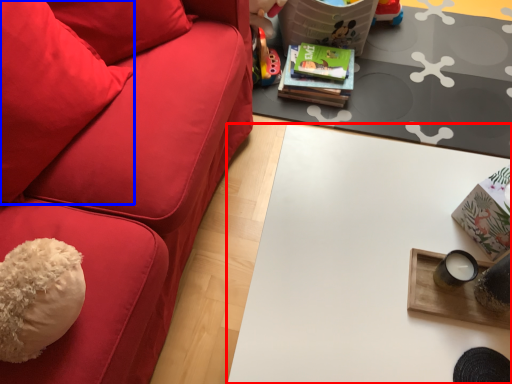
Question: Which point is closer to the camera, table (highlighted by a red box) or throw pillow (highlighted by a blue box)?

Choices:
 (A) table
 (B) throw pillow

Answer: (B)